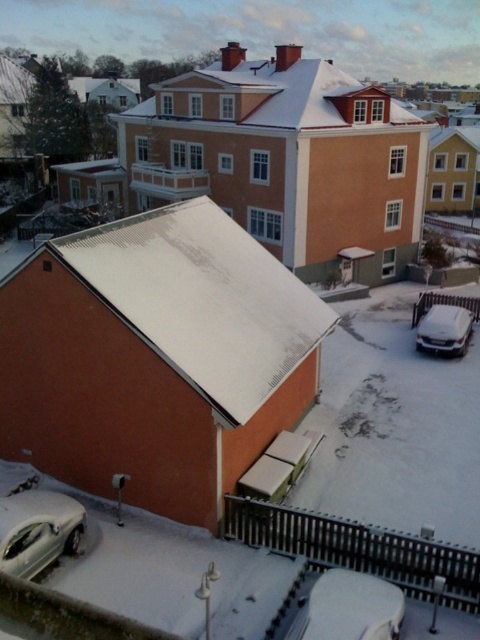
Between white matte car at lower center and white matte car at lower right, which one has less height?

With less height is white matte car at lower center.

Which is in front, point (370, 595) or point (421, 344)?

Point (370, 595)

The image size is (480, 640). What are the coordinates of `white matte car at lower center` in the screenshot? It's located at (348, 609).

Does point (361, 624) come farther from viewer compared to point (44, 534)?

No, (361, 624) is in front of (44, 534).

Measure the distance between white matte car at lower center and silver metallic car at lower left.

white matte car at lower center and silver metallic car at lower left are 19.52 feet apart.

Is point (393, 625) more distant than point (9, 552)?

No, it is not.

Find the location of a particular element. white matte car at lower center is located at coordinates (348, 609).

Is silver metallic car at lower left positioned in front of white matte car at lower right?

Yes, it is in front of white matte car at lower right.

Which is more to the right, silver metallic car at lower left or white matte car at lower right?

white matte car at lower right

The width and height of the screenshot is (480, 640). I want to click on silver metallic car at lower left, so click(37, 531).